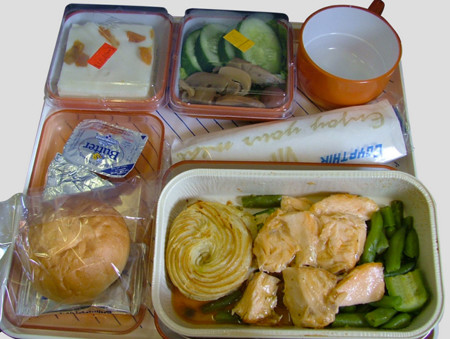
Where is `tray`? This screenshot has width=450, height=339. tray is located at coordinates (303, 107).